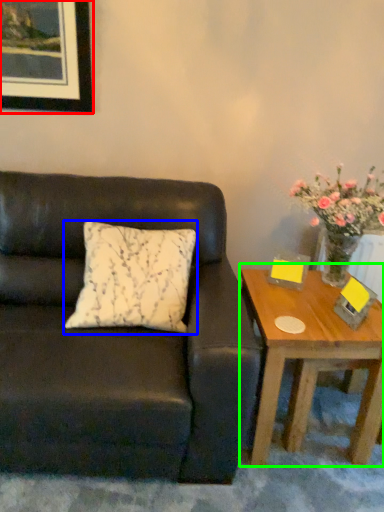
Question: Which is nearer to the picture frame (highlighted by a red box)? pillow (highlighted by a blue box) or coffee table (highlighted by a green box).

Choices:
 (A) pillow
 (B) coffee table

Answer: (A)